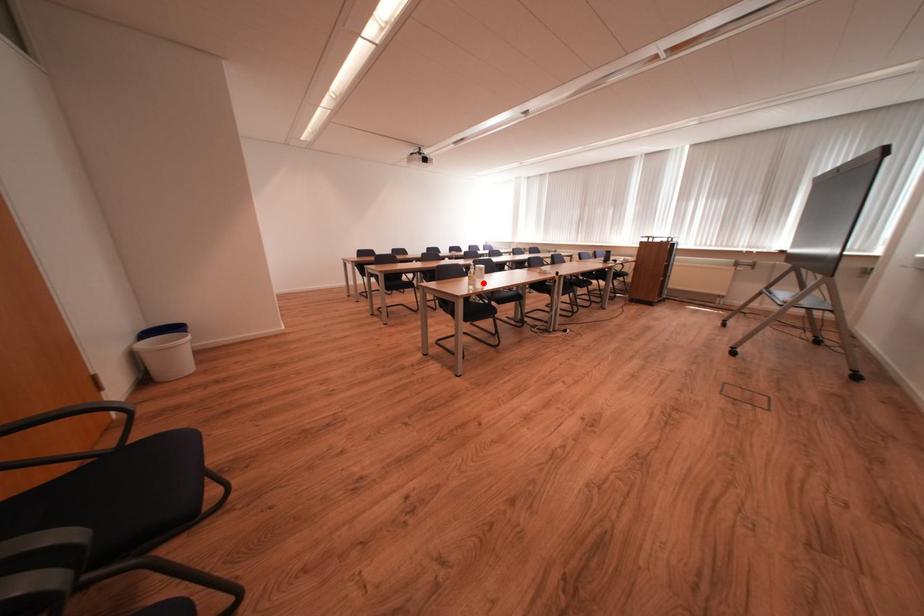
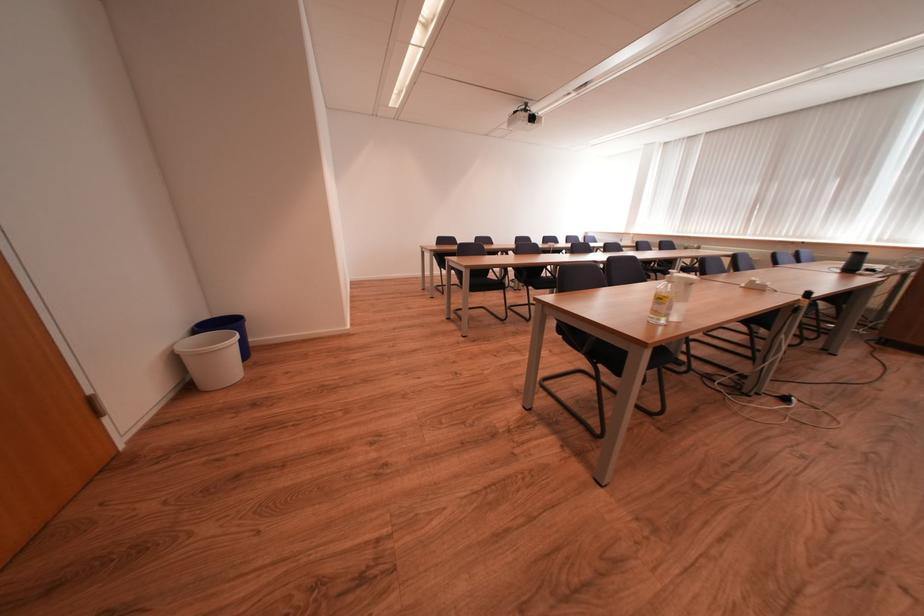
Locate, in the second image, the point that corresponds to the highlighted location in the first image.

(678, 310)